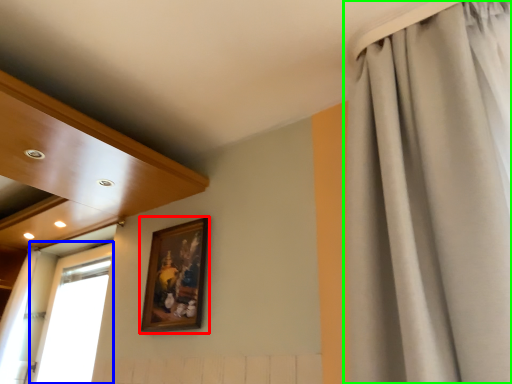
Question: Which object is positioned closest to picture frame (highlighted by a red box)? Select from window (highlighted by a blue box) and curtain (highlighted by a green box).

Choices:
 (A) window
 (B) curtain

Answer: (B)